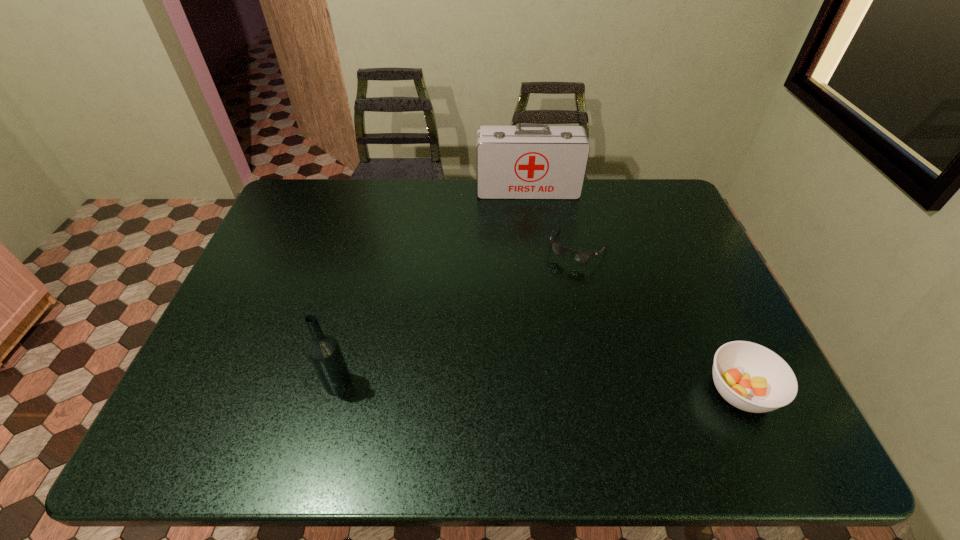
Locate an element on the screen. empty location between the second shortest object and the vodka is located at coordinates [539, 387].

Where is `free spot between the shortest object and the farthest object`? free spot between the shortest object and the farthest object is located at coordinates (553, 219).

You are a GUI agent. You are given a task and a screenshot of the screen. Output one action in this format:
    pyautogui.click(x=<x>, y=<y>)
    Task: Click on the empty space that is in between the rightmost object and the sunglasses
    
    Given the screenshot: What is the action you would take?
    pyautogui.click(x=659, y=320)

Image resolution: width=960 pixels, height=540 pixels. What are the coordinates of `empty location between the sunglasses and the first-aid kit` in the screenshot? It's located at (553, 219).

Find the location of a particular element. The width and height of the screenshot is (960, 540). object that is the closest one to the farthest object is located at coordinates (579, 256).

Find the location of a particular element. The height and width of the screenshot is (540, 960). the third closest object to the first-aid kit is located at coordinates (325, 354).

Locate an element on the screen. free spot that satisfies the following two spatial constraints: 1. on the front side of the first-aid kit; 2. on the right side of the sunglasses is located at coordinates (535, 248).

You are a GUI agent. You are given a task and a screenshot of the screen. Output one action in this format:
    pyautogui.click(x=<x>, y=<y>)
    Task: Click on the vacant position in the image that satisfies the following two spatial constraints: 1. on the back side of the second farthest object; 2. on the right side of the vodka
    This screenshot has width=960, height=540.
    Given the screenshot: What is the action you would take?
    pyautogui.click(x=372, y=248)

Where is `free region that satisfies the following two spatial constraints: 1. on the front side of the sunglasses; 2. on the right side of the second shortest object`? The image size is (960, 540). free region that satisfies the following two spatial constraints: 1. on the front side of the sunglasses; 2. on the right side of the second shortest object is located at coordinates (611, 392).